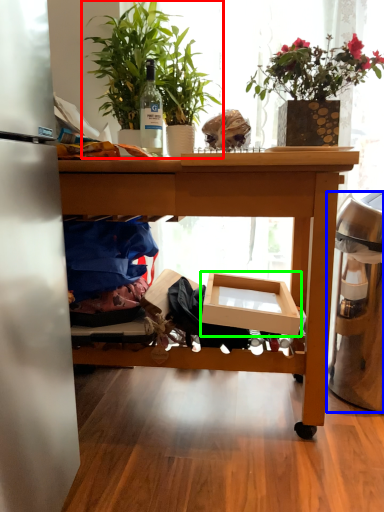
Question: Which object is positioned farthest from houseplant (highlighted by a red box)? Select from trash bin/can (highlighted by a blue box) and cardboard box (highlighted by a green box).

Choices:
 (A) trash bin/can
 (B) cardboard box

Answer: (A)